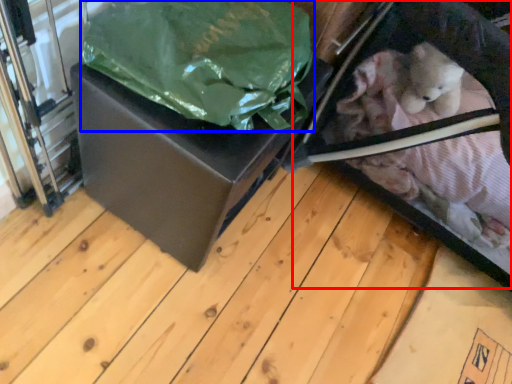
Question: Which object appears closest to the camera in this image, baby carriage (highlighted by a red box) or plastic bag (highlighted by a blue box)?

Choices:
 (A) baby carriage
 (B) plastic bag

Answer: (B)